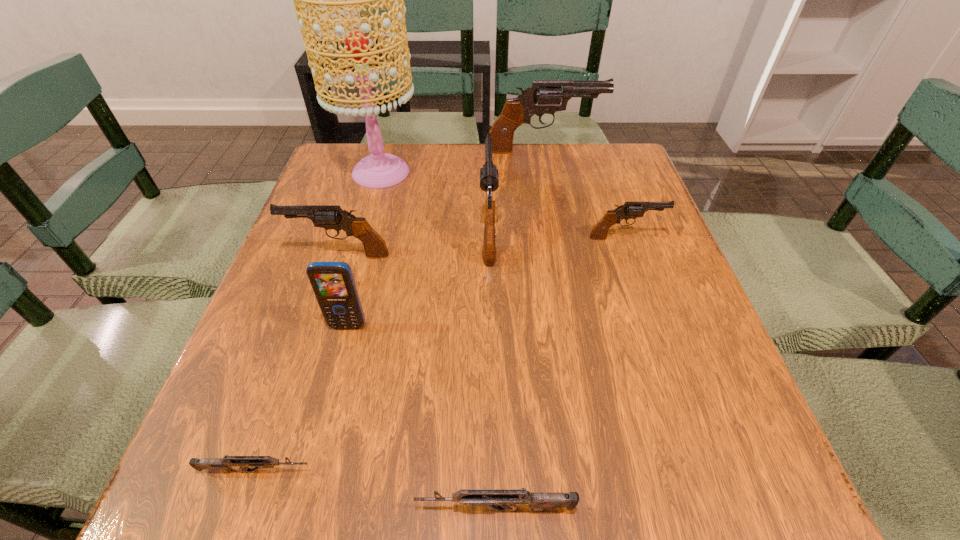
Where is `lampshade`? lampshade is located at coordinates (379, 170).

This screenshot has height=540, width=960. I want to click on the farthest black gun, so click(x=548, y=94).

The width and height of the screenshot is (960, 540). Find the location of `the biggest black gun`. the biggest black gun is located at coordinates (548, 94).

Image resolution: width=960 pixels, height=540 pixels. What are the coordinates of `the fifth shortest gun` in the screenshot? It's located at (489, 180).

The image size is (960, 540). In order to click on the sixth farthest object in this screenshot , I will do `click(333, 283)`.

This screenshot has height=540, width=960. Identify the location of the third biggest black gun. (328, 217).

Where is `the fourth shortest object`? The width and height of the screenshot is (960, 540). the fourth shortest object is located at coordinates (328, 217).

This screenshot has height=540, width=960. What are the coordinates of `the smallest black gun` in the screenshot? It's located at (629, 210).

Find the location of a particular element. The height and width of the screenshot is (540, 960). the fourth tallest gun is located at coordinates (629, 210).

At what (x,y) coordinates should I click in order to perform the action: click on the fifth tallest gun. Please return your answer as a coordinate pair (x, y). This screenshot has height=540, width=960. Looking at the image, I should click on (505, 500).